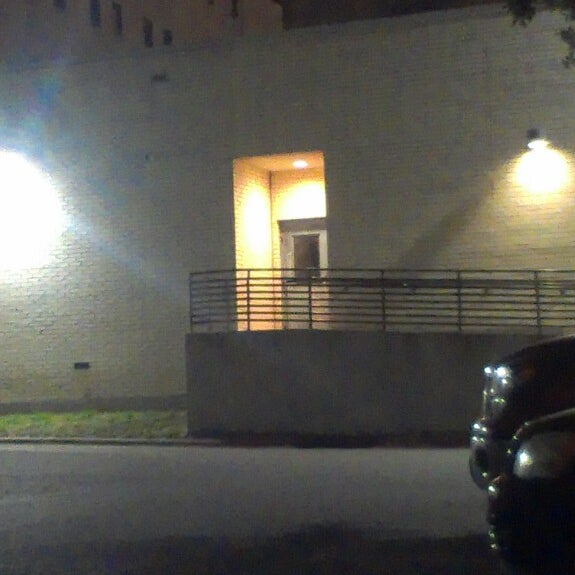
The height and width of the screenshot is (575, 575). I want to click on gray metallic door, so click(x=288, y=251).